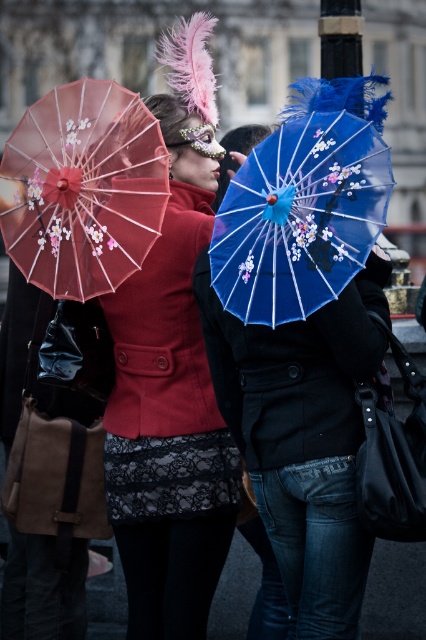
Question: Can you confirm if matte pink parasol at left is wider than blue glossy parasol at center?

Choices:
 (A) yes
 (B) no

Answer: (A)

Question: Which of the following is the closest to the observer?

Choices:
 (A) matte pink parasol at left
 (B) blue glossy parasol at center

Answer: (B)

Question: Is matte pink parasol at left wider than blue glossy parasol at center?

Choices:
 (A) yes
 (B) no

Answer: (A)

Question: Which of the following is the farthest from the observer?

Choices:
 (A) (221, 225)
 (B) (17, 198)

Answer: (B)

Question: Does matte pink parasol at left appear on the right side of blue glossy parasol at center?

Choices:
 (A) no
 (B) yes

Answer: (A)